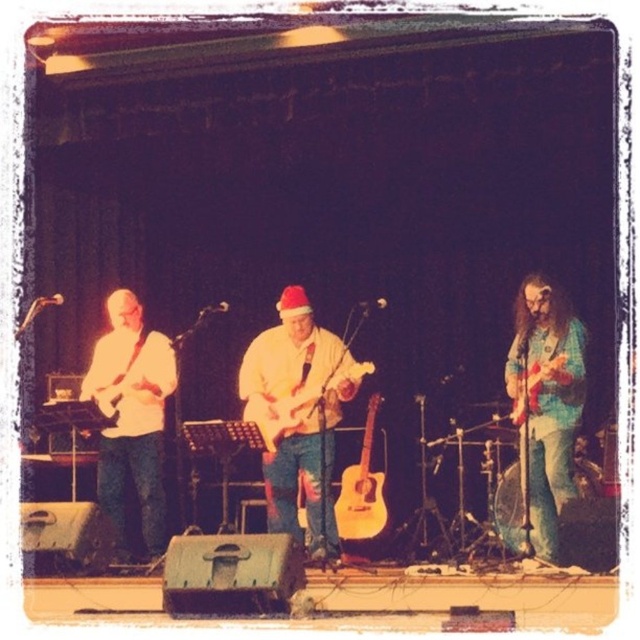
Which is above, shiny teal shirt at right or acoustic wood guitar at center?

shiny teal shirt at right is above.

Is shiny teal shirt at right wider than acoustic wood guitar at center?

Correct, the width of shiny teal shirt at right exceeds that of acoustic wood guitar at center.

Between point (545, 400) and point (340, 481), which one is positioned behind?

Point (340, 481)

At what (x,y) coordinates should I click in order to perform the action: click on shiny teal shirt at right. Please return your answer as a coordinate pair (x, y). The height and width of the screenshot is (640, 640). Looking at the image, I should click on (x=547, y=401).

Is acoustic wood guitar at center bigger than wooden acoustic guitar at right?

Indeed, acoustic wood guitar at center has a larger size compared to wooden acoustic guitar at right.

Does acoustic wood guitar at center have a lesser width compared to wooden acoustic guitar at right?

No.

Where is `acoustic wood guitar at center`? The width and height of the screenshot is (640, 640). acoustic wood guitar at center is located at coordinates (362, 490).

Does white glossy electric guitar at center come behind wooden acoustic guitar at right?

No, white glossy electric guitar at center is in front of wooden acoustic guitar at right.

Is point (269, 435) less distant than point (541, 365)?

No.

Who is more forward, (280, 381) or (524, 372)?

Point (524, 372) is in front.

At what (x,y) coordinates should I click in order to perform the action: click on white glossy electric guitar at center. Please return your answer as a coordinate pair (x, y). This screenshot has width=640, height=640. Looking at the image, I should click on (305, 403).